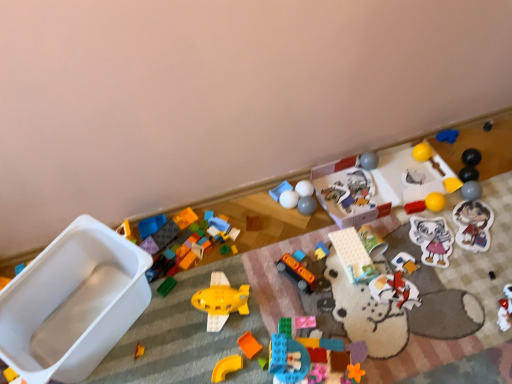
At what (x,y) coordinates should I click in order to perform the action: click on vacant space that is to the left of yellow plastic curve at center, the fifth toy in the left-to-right sequence. Please return your answer as a coordinate pair (x, y). Looking at the image, I should click on (175, 356).